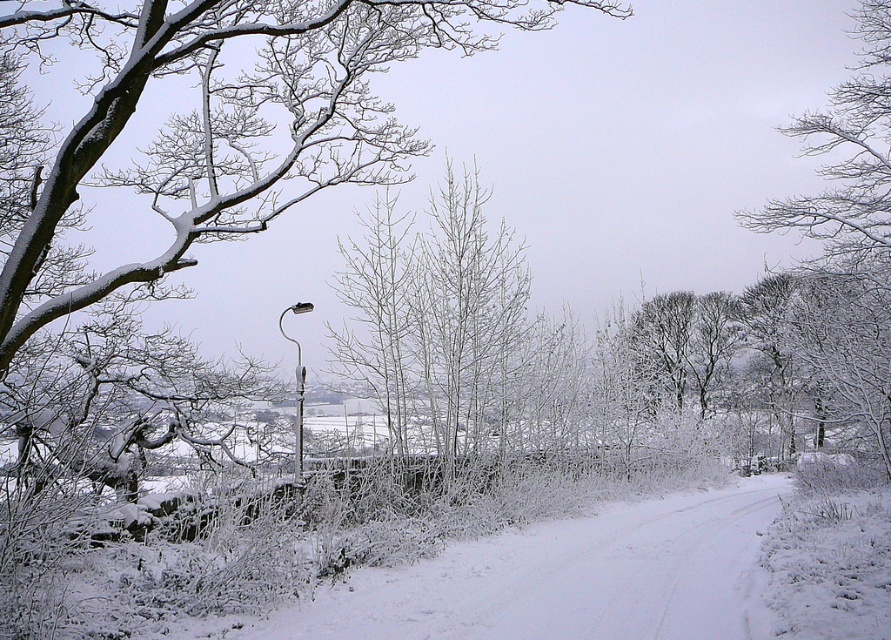
Is snow-covered branches at upper left to the left of white frosty branches at upper right from the viewer's perspective?

Indeed, snow-covered branches at upper left is positioned on the left side of white frosty branches at upper right.

What do you see at coordinates (233, 118) in the screenshot? The height and width of the screenshot is (640, 891). I see `snow-covered branches at upper left` at bounding box center [233, 118].

At what (x,y) coordinates should I click in order to perform the action: click on snow-covered branches at upper left. Please return your answer as a coordinate pair (x, y). Looking at the image, I should click on (233, 118).